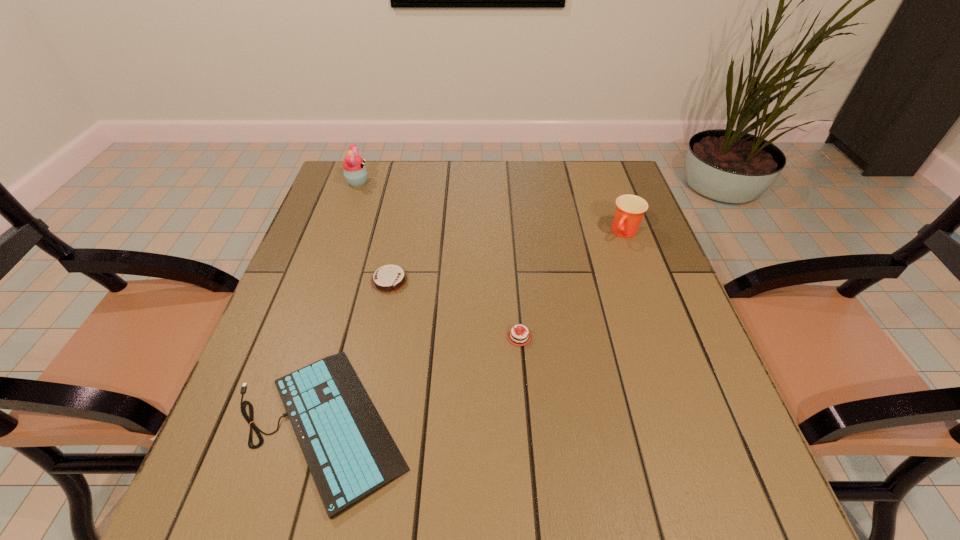
What are the coordinates of `vacant space located on the front of the rightmost object` in the screenshot? It's located at [x=642, y=280].

Where is `vacant space situated on the left of the nearer chocolate cake`? The image size is (960, 540). vacant space situated on the left of the nearer chocolate cake is located at coordinates (357, 337).

Find the location of `free location located 0.150m on the right of the third nearest object`. free location located 0.150m on the right of the third nearest object is located at coordinates (470, 281).

The height and width of the screenshot is (540, 960). Find the location of `vacant space situated 0.170m on the right of the computer keyboard`. vacant space situated 0.170m on the right of the computer keyboard is located at coordinates (508, 425).

The width and height of the screenshot is (960, 540). Identify the location of object that is at the far edge. (355, 172).

Identify the location of object located at the near edge. Image resolution: width=960 pixels, height=540 pixels. (350, 453).

Locate an element on the screen. cupcake positioned at the left edge is located at coordinates (355, 172).

Locate an element on the screen. This screenshot has height=540, width=960. computer keyboard at the left edge is located at coordinates (350, 453).

The width and height of the screenshot is (960, 540). I want to click on object situated at the right edge, so click(x=630, y=209).

You are a GUI agent. You are given a task and a screenshot of the screen. Output one action in this format:
    pyautogui.click(x=<x>, y=<y>)
    Task: Click on the object positioned at the far left corner
    The width and height of the screenshot is (960, 540).
    Given the screenshot: What is the action you would take?
    pyautogui.click(x=355, y=172)